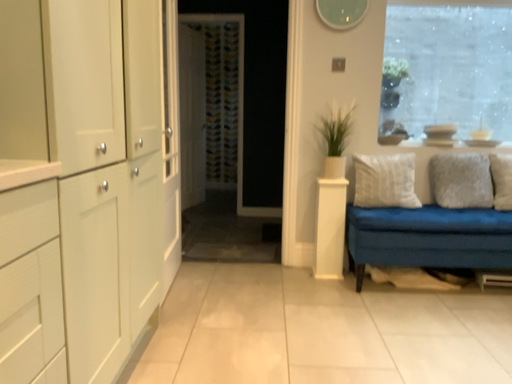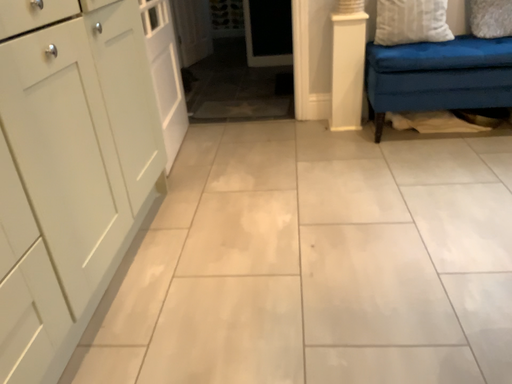
Question: Which way did the camera rotate in the video?

Choices:
 (A) rotated downward
 (B) rotated upward

Answer: (A)